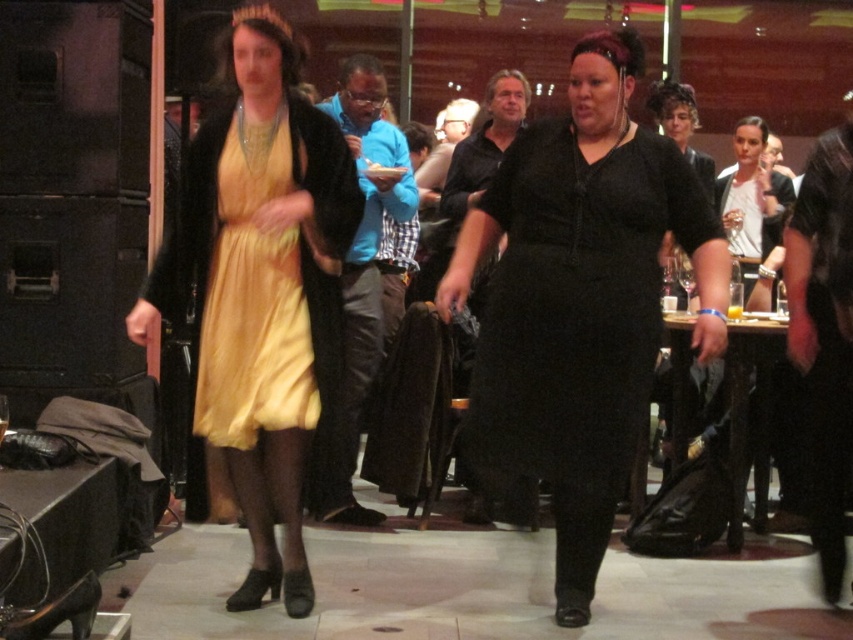
You are a photographer at a fashion show and need to capture a closeup of both the black velvet dress at center and the yellow satin dress at center in the same frame. The camera you are using has a maximum focus range of 90 centimeters. Can you fit both dresses in the frame without moving the camera?

The black velvet dress at center and yellow satin dress at center are 92.56 centimeters apart, which exceeds the camera maximum focus range of 90 centimeters. Therefore, you cannot fit both dresses in the frame without moving the camera.

You are a photographer trying to capture a photo of the two people in the scene. You notice the satin yellow dress at center and the yellow satin dress at center. Which one should you focus on to ensure the full width of the dress is visible in the frame?

The satin yellow dress at center is wider than the yellow satin dress at center, so focusing on the satin yellow dress at center will ensure its full width is visible in the frame.

You are at the point with coordinates point (498, 188) and want to move to the point with coordinates point (265, 205). Is there a clear path between these two points?

Point (498, 188) is behind point (265, 205), so there is no clear path between them.